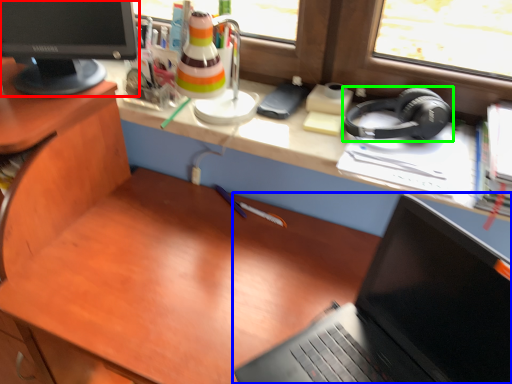
Question: Which object is the closest to the computer monitor (highlighted by a red box)? Choose among these: laptop (highlighted by a blue box) or headphones (highlighted by a green box).

Choices:
 (A) laptop
 (B) headphones

Answer: (B)